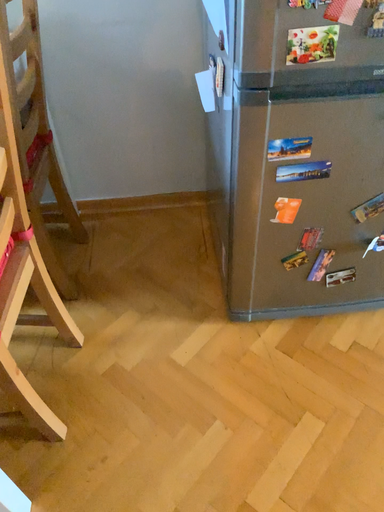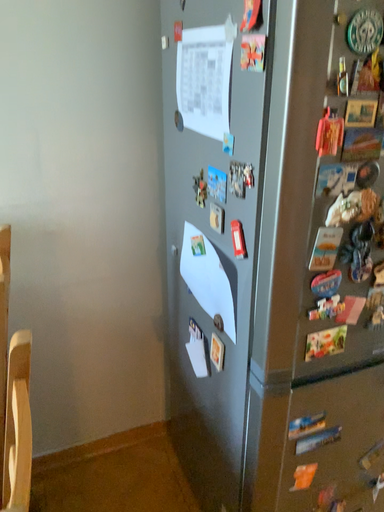
Question: Which way did the camera rotate in the video?

Choices:
 (A) rotated upward
 (B) rotated downward

Answer: (A)